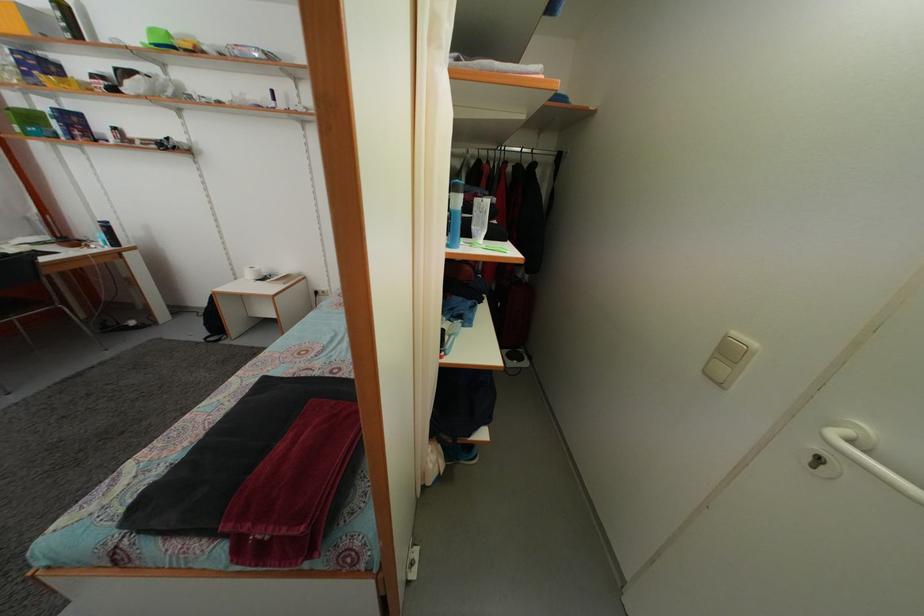
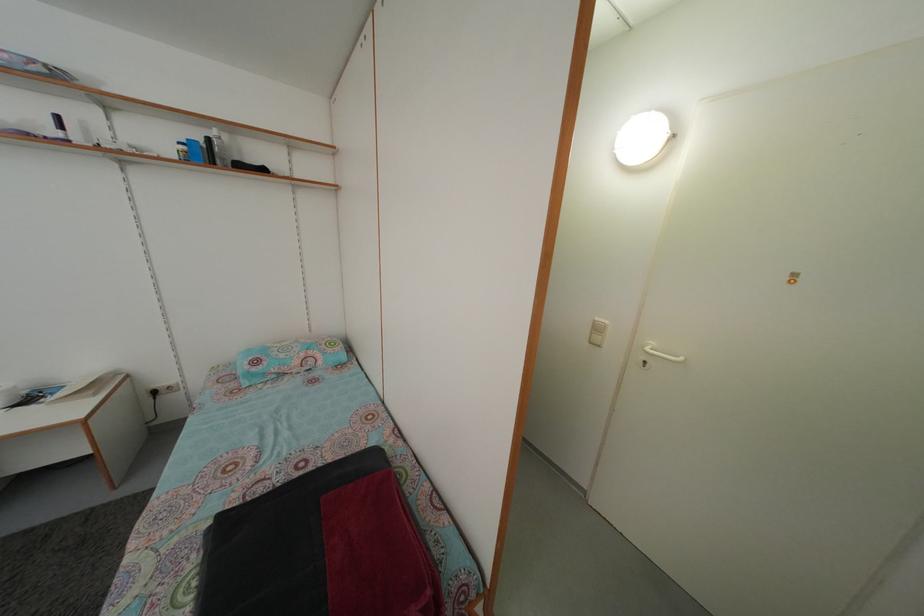
Find the pixel in the second image that matches pixel 740 341 in the first image.

(602, 326)